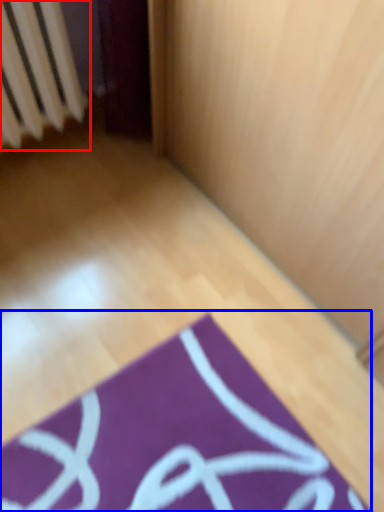
Question: Which object appears closest to the camera in this image, radiator (highlighted by a red box) or yoga mat (highlighted by a blue box)?

Choices:
 (A) radiator
 (B) yoga mat

Answer: (B)